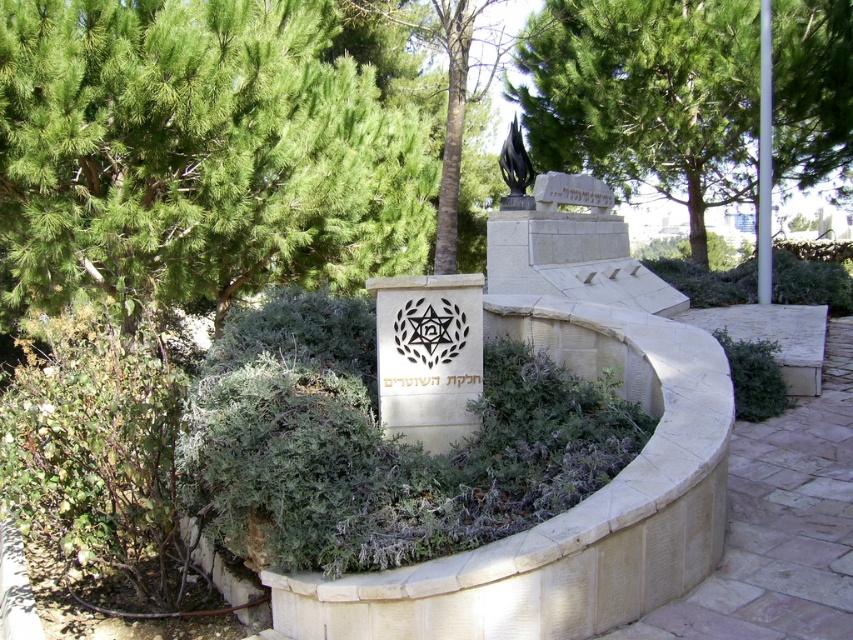
Question: Does green leafy tree at upper left have a larger size compared to green leafy tree at upper center?

Choices:
 (A) no
 (B) yes

Answer: (B)

Question: Considering the real-world distances, which object is farthest from the green leafy tree at upper center?

Choices:
 (A) black glossy sculpture at upper center
 (B) green leafy tree at center

Answer: (B)

Question: Among these objects, which one is nearest to the camera?

Choices:
 (A) green leafy tree at upper center
 (B) green leafy tree at upper left

Answer: (B)

Question: Which object is positioned closest to the green leafy tree at upper center?

Choices:
 (A) green leafy tree at center
 (B) black glossy sculpture at upper center
 (C) green leafy tree at upper left

Answer: (B)

Question: In this image, where is green leafy tree at upper left located relative to green leafy tree at upper center?

Choices:
 (A) right
 (B) left

Answer: (B)

Question: Is green leafy tree at upper center positioned before black glossy sculpture at upper center?

Choices:
 (A) yes
 (B) no

Answer: (B)